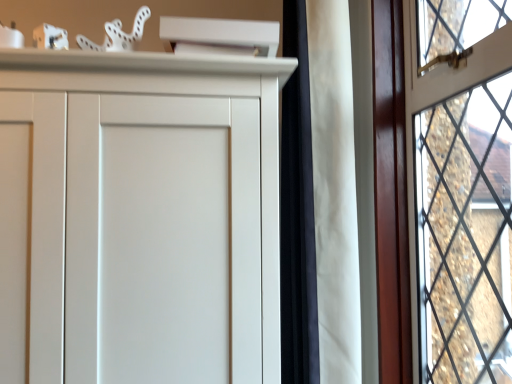
Describe the element at coordinates (444, 190) in the screenshot. I see `matte wooden window at right` at that location.

The width and height of the screenshot is (512, 384). In order to click on matte wooden window at right in this screenshot , I will do `click(444, 190)`.

What do you see at coordinates (319, 199) in the screenshot? I see `white matte curtain at center` at bounding box center [319, 199].

The width and height of the screenshot is (512, 384). Identify the location of white matte curtain at center. (319, 199).

In order to click on matte wooden window at right in this screenshot , I will do `click(444, 190)`.

Considering the positions of objects white matte curtain at center and matte wooden window at right in the image provided, who is more to the left, white matte curtain at center or matte wooden window at right?

white matte curtain at center.

Is the depth of white matte curtain at center greater than that of matte wooden window at right?

Yes, it is.

Is point (345, 171) more distant than point (420, 189)?

No.

Consider the image. From the image's perspective, who appears lower, white matte curtain at center or matte wooden window at right?

From the image's view, matte wooden window at right is below.

From a real-world perspective, is white matte curtain at center over matte wooden window at right?

Yes, from a real-world perspective, white matte curtain at center is over matte wooden window at right

In terms of width, does white matte curtain at center look wider or thinner when compared to matte wooden window at right?

Considering their sizes, white matte curtain at center looks slimmer than matte wooden window at right.

Between white matte curtain at center and matte wooden window at right, which one has more height?

white matte curtain at center is taller.

Based on their sizes in the image, would you say white matte curtain at center is bigger or smaller than matte wooden window at right?

Clearly, white matte curtain at center is larger in size than matte wooden window at right.

Is white matte curtain at center positioned beyond the bounds of matte wooden window at right?

Indeed, white matte curtain at center is completely outside matte wooden window at right.

Is white matte curtain at center not near matte wooden window at right?

No, white matte curtain at center is not far from matte wooden window at right.

Is white matte curtain at center facing away from matte wooden window at right?

Correct, white matte curtain at center is looking away from matte wooden window at right.

In order to click on window lying below the white matte curtain at center (from the image's perspective) in this screenshot , I will do `click(444, 190)`.

Considering the relative positions of matte wooden window at right and white matte curtain at center in the image provided, is matte wooden window at right to the left or to the right of white matte curtain at center?

matte wooden window at right is positioned on white matte curtain at center's right side.

Which is in front, matte wooden window at right or white matte curtain at center?

matte wooden window at right.

Is point (449, 25) farther from viewer compared to point (327, 202)?

Yes, it is behind point (327, 202).

From the image's perspective, is matte wooden window at right above or below white matte curtain at center?

matte wooden window at right is situated lower than white matte curtain at center in the image.

Consider the image. From a real-world perspective, between matte wooden window at right and white matte curtain at center, who is vertically higher?

In real-world perspective, white matte curtain at center is above.

Does matte wooden window at right have a lesser width compared to white matte curtain at center?

Incorrect, the width of matte wooden window at right is not less than that of white matte curtain at center.

Considering the sizes of matte wooden window at right and white matte curtain at center in the image, is matte wooden window at right taller or shorter than white matte curtain at center?

Clearly, matte wooden window at right is shorter compared to white matte curtain at center.

Between matte wooden window at right and white matte curtain at center, which one has smaller size?

Smaller between the two is matte wooden window at right.

Consider the image. Is matte wooden window at right surrounding white matte curtain at center?

No.

Are matte wooden window at right and white matte curtain at center located far from each other?

matte wooden window at right is actually quite close to white matte curtain at center.

Is matte wooden window at right looking in the opposite direction of white matte curtain at center?

Yes, white matte curtain at center is at the back of matte wooden window at right.

From the picture: How far apart are matte wooden window at right and white matte curtain at center?

A distance of 21.12 centimeters exists between matte wooden window at right and white matte curtain at center.

Identify the location of curtain that is on the left side of matte wooden window at right. (319, 199).

The width and height of the screenshot is (512, 384). Find the location of `window below the white matte curtain at center (from the image's perspective)`. window below the white matte curtain at center (from the image's perspective) is located at coordinates (444, 190).

You are a GUI agent. You are given a task and a screenshot of the screen. Output one action in this format:
    pyautogui.click(x=<x>, y=<y>)
    Task: Click on the window on the right of white matte curtain at center
    The height and width of the screenshot is (384, 512).
    Given the screenshot: What is the action you would take?
    pyautogui.click(x=444, y=190)